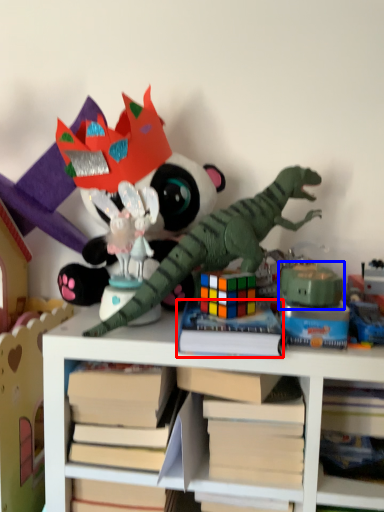
Question: Which object is closer to the camera taking this photo, paperback book (highlighted by a red box) or toy (highlighted by a blue box)?

Choices:
 (A) paperback book
 (B) toy

Answer: (A)